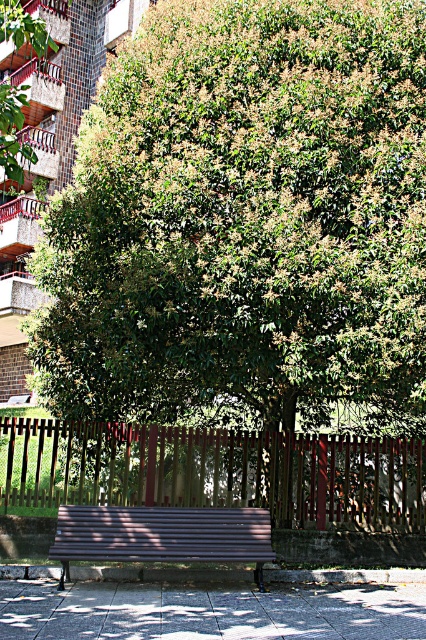
Which is more to the right, brown wooden fence at center or smooth concrete pavement at center?

brown wooden fence at center

Between point (135, 464) and point (252, 628), which one is positioned in front?

Point (252, 628)

Find the location of `brown wooden fence at center`. brown wooden fence at center is located at coordinates (213, 470).

Can you confirm if brown wooden fence at center is smaller than brown wooden bench at center?

Actually, brown wooden fence at center might be larger than brown wooden bench at center.

What do you see at coordinates (213, 470) in the screenshot? Image resolution: width=426 pixels, height=640 pixels. I see `brown wooden fence at center` at bounding box center [213, 470].

Where is `brown wooden fence at center`? The width and height of the screenshot is (426, 640). brown wooden fence at center is located at coordinates (213, 470).

Locate an element on the screen. Image resolution: width=426 pixels, height=640 pixels. brown wooden fence at center is located at coordinates (213, 470).

Who is more forward, (x=144, y=592) or (x=129, y=557)?

Positioned in front is point (x=129, y=557).

Is smooth concrete pavement at center behind brown wooden bench at center?

No, smooth concrete pavement at center is in front of brown wooden bench at center.

The width and height of the screenshot is (426, 640). In order to click on smooth concrete pavement at center in this screenshot , I will do `click(215, 609)`.